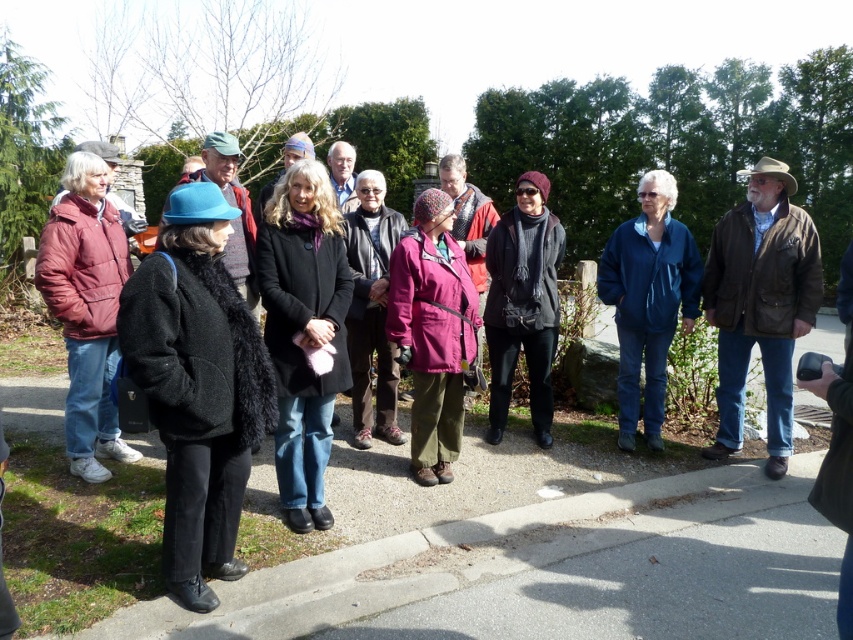
Looking at this image, you are a fashion designer observing the group of people in the image. You need to determine which item is more suitable for a winter collection based on their thickness. Which one is thicker between the black wool coat at center and the knitted dark gray scarf at center?

The knitted dark gray scarf at center is thicker than the black wool coat at center, making it more suitable for a winter collection.

You are a tailor who needs to determine the appropriate size of a garment. You observe the matte black coat at left and the pink fabric jacket at center in the image. Which of these two garments has a greater width?

The matte black coat at left has a greater width than the pink fabric jacket at center.